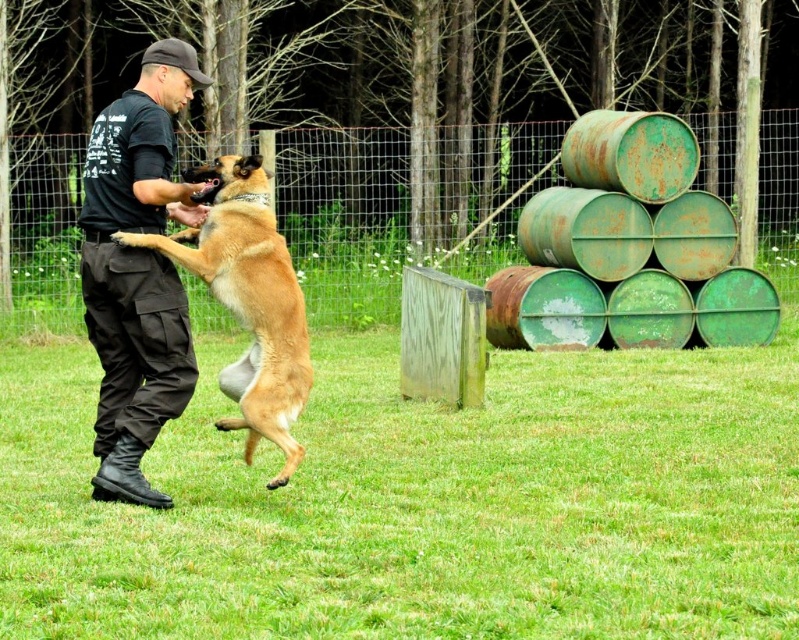
You are standing where the man is in the scene. You want to throw a ball to the furry golden dog at center. Which direction should you aim so the ball goes past the rusty green barrel at right and reaches the dog?

You should aim to the left of the rusty green barrel at right because the rusty green barrel at right is to the right of the furry golden dog at center, so throwing left would go towards the dog.

You are a photographer trying to capture a closeup shot of both the black cotton shirt at center and the furry golden dog at center in the scene. Your camera has a maximum focus range that can only capture objects within 40 centimeters of each other. Can you take the photo without moving either subject?

The black cotton shirt at center and the furry golden dog at center are 40.65 centimeters apart. Since the distance between them exceeds the camera maximum focus range of 40 centimeters, you cannot take the photo without moving either subject.

You are a photographer trying to capture the black cotton shirt at center in the image. What are the coordinates where you should focus your camera?

The black cotton shirt at center is located at coordinates point (137, 269).